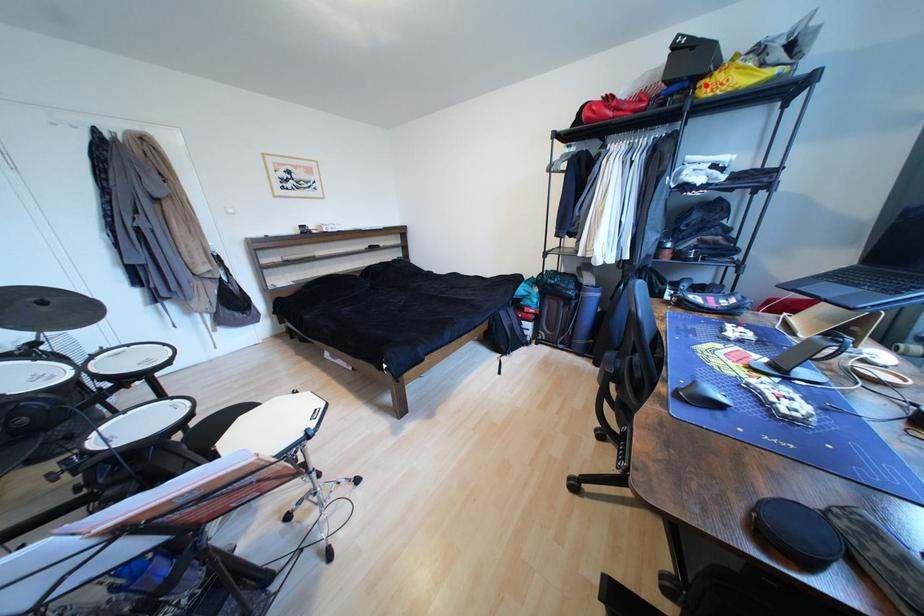
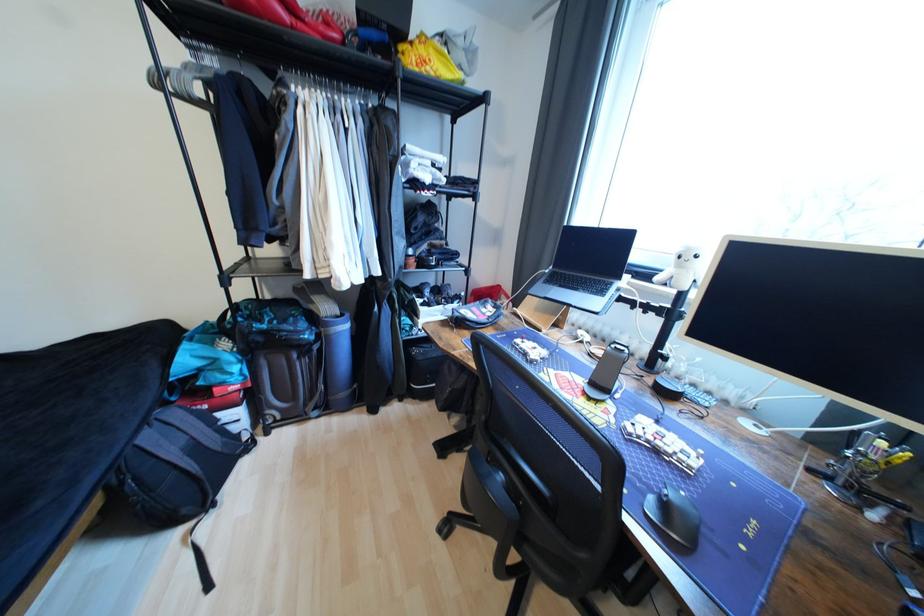
Find the pixel in the second image that matches the highlighted location in the first image.

(407, 49)